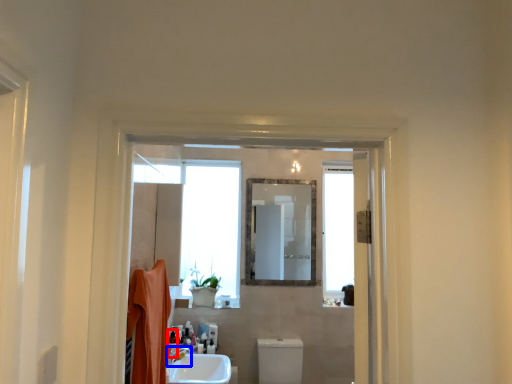
Question: Among these objects, which one is nearest to the camera, toiletry (highlighted by a red box) or tap (highlighted by a blue box)?

Choices:
 (A) toiletry
 (B) tap

Answer: (B)